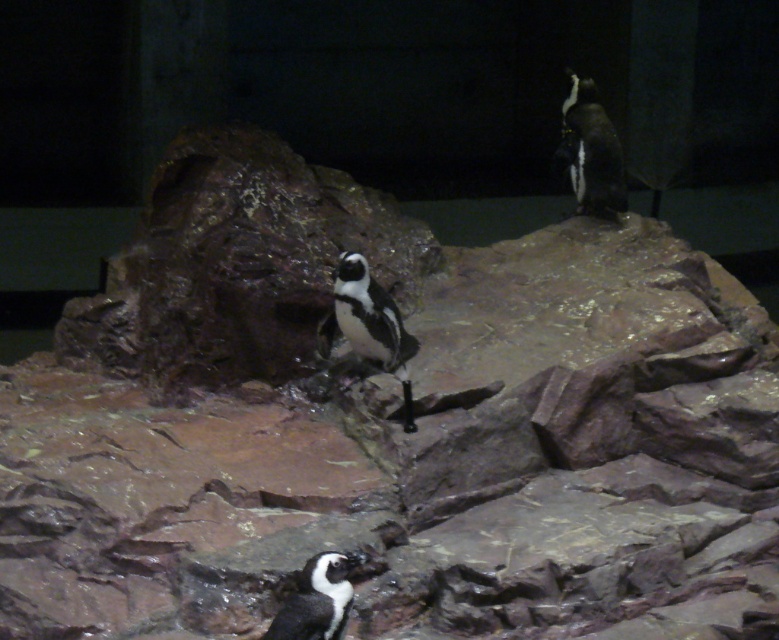
Question: Which of the following is the closest to the observer?

Choices:
 (A) black matte penguin at center
 (B) black glossy penguin at lower center
 (C) black and white feathers at upper right

Answer: (B)

Question: Can you confirm if black matte penguin at center is positioned below black glossy penguin at lower center?

Choices:
 (A) no
 (B) yes

Answer: (A)

Question: Which point appears closest to the camera in this image?

Choices:
 (A) (379, 344)
 (B) (323, 561)

Answer: (B)

Question: Which point is farther from the camera taking this photo?

Choices:
 (A) (369, 342)
 (B) (594, 118)
 (C) (318, 586)

Answer: (B)

Question: Where is black and white feathers at upper right located in relation to black glossy penguin at lower center in the image?

Choices:
 (A) right
 (B) left

Answer: (A)

Question: Is black matte penguin at center positioned before black and white feathers at upper right?

Choices:
 (A) no
 (B) yes

Answer: (B)